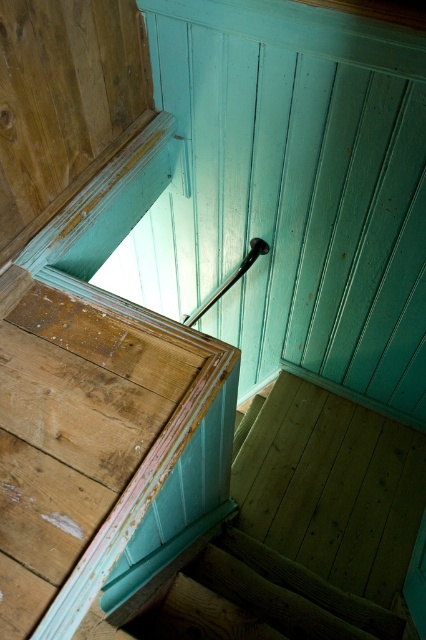
Question: Can you confirm if wooden at center is wider than black glossy rail at upper center?

Choices:
 (A) yes
 (B) no

Answer: (A)

Question: Is wooden handrail at upper left positioned before black glossy rail at upper center?

Choices:
 (A) no
 (B) yes

Answer: (B)

Question: Which object is closer to the camera taking this photo?

Choices:
 (A) black glossy rail at upper center
 (B) wooden at center
 (C) wooden handrail at upper left

Answer: (C)

Question: Which of these objects is positioned farthest from the wooden at center?

Choices:
 (A) black glossy rail at upper center
 (B) wooden handrail at upper left

Answer: (A)

Question: Can you confirm if wooden handrail at upper left is positioned to the right of black glossy rail at upper center?

Choices:
 (A) yes
 (B) no

Answer: (B)

Question: Which point is closer to the camera?

Choices:
 (A) black glossy rail at upper center
 (B) wooden at center

Answer: (B)